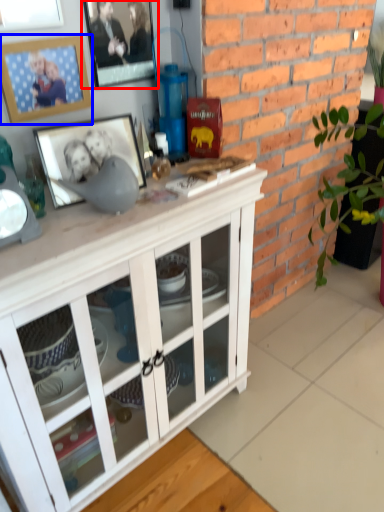
Question: Which of the following is the closest to the observer, picture frame (highlighted by a red box) or picture frame (highlighted by a blue box)?

Choices:
 (A) picture frame
 (B) picture frame

Answer: (B)